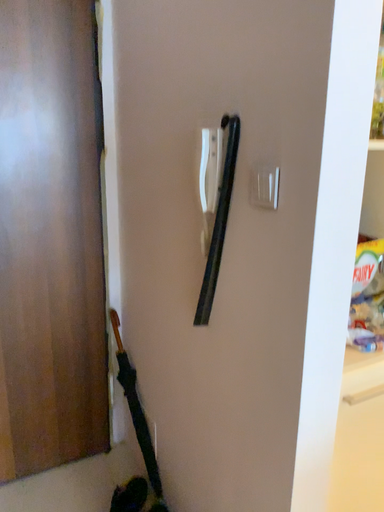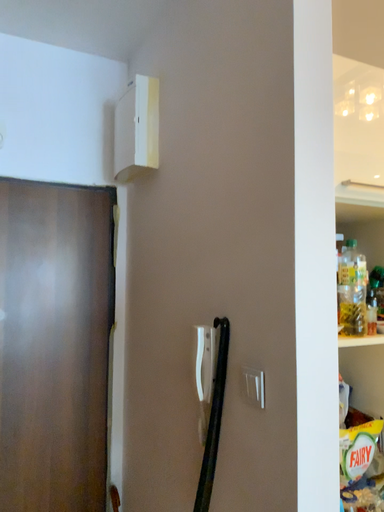
Question: How did the camera likely rotate when shooting the video?

Choices:
 (A) rotated upward
 (B) rotated downward

Answer: (A)